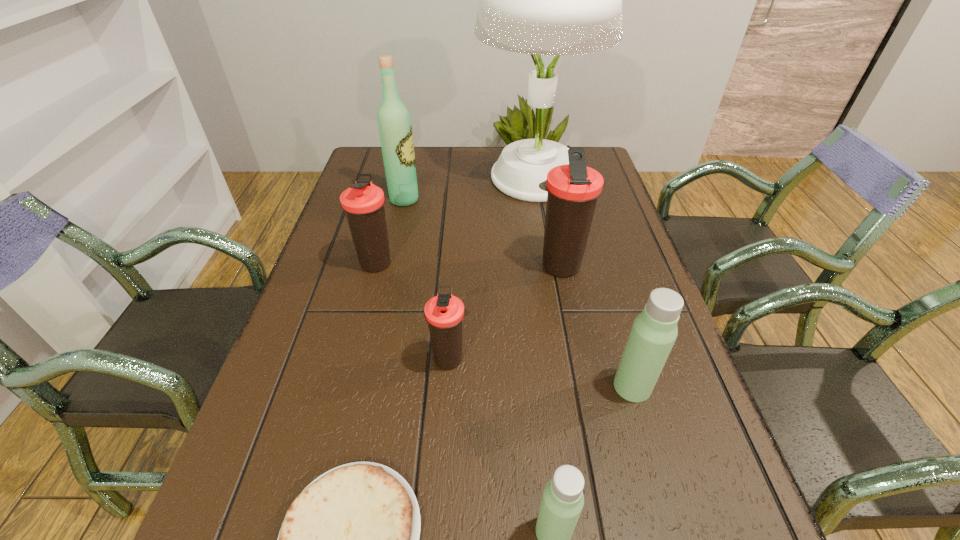
Where is `the nearest brown thermos bottle`? The height and width of the screenshot is (540, 960). the nearest brown thermos bottle is located at coordinates (444, 313).

Locate an element on the screen. Image resolution: width=960 pixels, height=540 pixels. the smallest brown thermos bottle is located at coordinates (444, 313).

Where is `vacant point located 0.290m on the front-facing side of the lamp`? The width and height of the screenshot is (960, 540). vacant point located 0.290m on the front-facing side of the lamp is located at coordinates (384, 177).

The width and height of the screenshot is (960, 540). What are the coordinates of `vacant space located on the front-facing side of the lamp` in the screenshot? It's located at (421, 177).

This screenshot has width=960, height=540. Find the location of `vacant region located on the front-facing side of the lamp`. vacant region located on the front-facing side of the lamp is located at coordinates (369, 177).

The height and width of the screenshot is (540, 960). Find the location of `vacant position located 0.130m on the front-facing side of the wine bottle`. vacant position located 0.130m on the front-facing side of the wine bottle is located at coordinates (463, 200).

Identify the location of free space located 0.170m on the front of the tallest thermos bottle. This screenshot has width=960, height=540. (573, 341).

Locate an element on the screen. The width and height of the screenshot is (960, 540). vacant space located on the right of the second smallest brown thermos bottle is located at coordinates (532, 262).

In order to click on vacant region located 0.050m on the front of the farther light thermos bottle in this screenshot , I will do `click(644, 428)`.

At what (x,y) coordinates should I click in order to perform the action: click on vacant space situated on the back of the second brown thermos bottle from right to left. Please return your answer as a coordinate pair (x, y). This screenshot has height=540, width=960. Looking at the image, I should click on (455, 275).